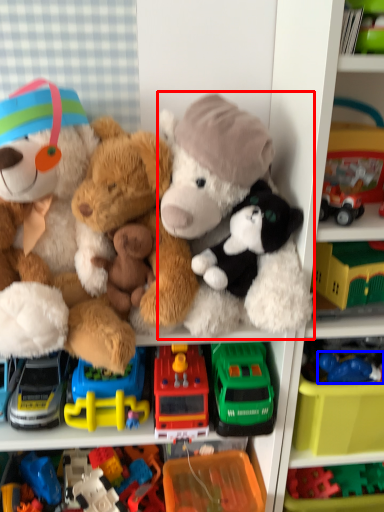
Question: Which object is closer to the camera taking this photo, teddy bear (highlighted by a red box) or toy (highlighted by a blue box)?

Choices:
 (A) teddy bear
 (B) toy

Answer: (A)